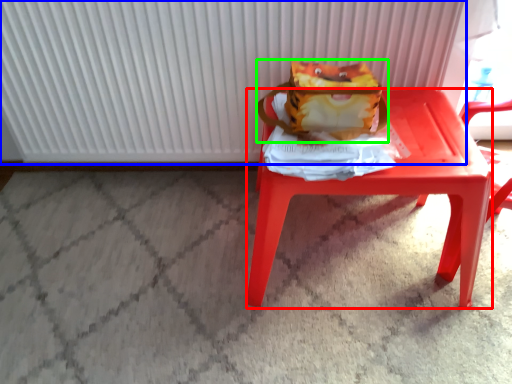
Question: Considering the real-world distances, which object is farthest from stool (highlighted by a red box)? radiator (highlighted by a blue box) or shoulder bag (highlighted by a green box)?

Choices:
 (A) radiator
 (B) shoulder bag

Answer: (A)